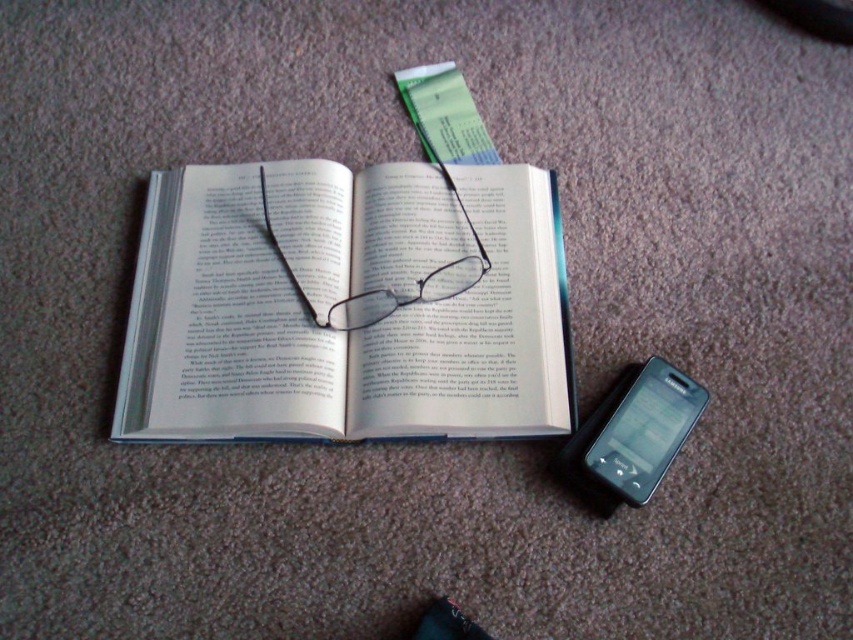
Who is taller, white paper at center or matte black smartphone at lower right?

Standing taller between the two is white paper at center.

Identify the location of white paper at center. (346, 305).

Who is positioned more to the left, white paper at center or transparent plastic glasses at center?

From the viewer's perspective, white paper at center appears more on the left side.

Identify the location of white paper at center. (346, 305).

How much distance is there between matte black smartphone at lower right and transparent plastic glasses at center?

matte black smartphone at lower right and transparent plastic glasses at center are 13.19 inches apart.

From the picture: Can you confirm if matte black smartphone at lower right is shorter than transparent plastic glasses at center?

Indeed, matte black smartphone at lower right has a lesser height compared to transparent plastic glasses at center.

Is point (628, 442) less distant than point (354, 321)?

Yes, it is.

The height and width of the screenshot is (640, 853). What are the coordinates of `matte black smartphone at lower right` in the screenshot? It's located at (639, 429).